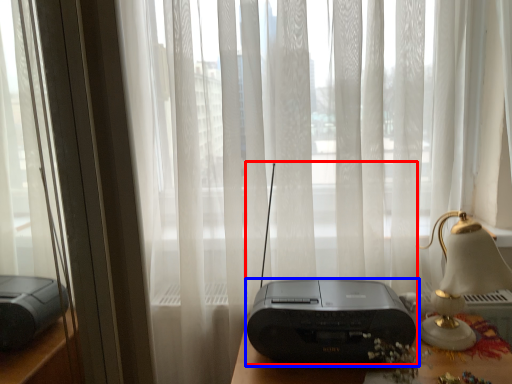
Question: Which of the following is the closest to the observer, gadget (highlighted by a red box) or printer (highlighted by a blue box)?

Choices:
 (A) gadget
 (B) printer

Answer: (A)